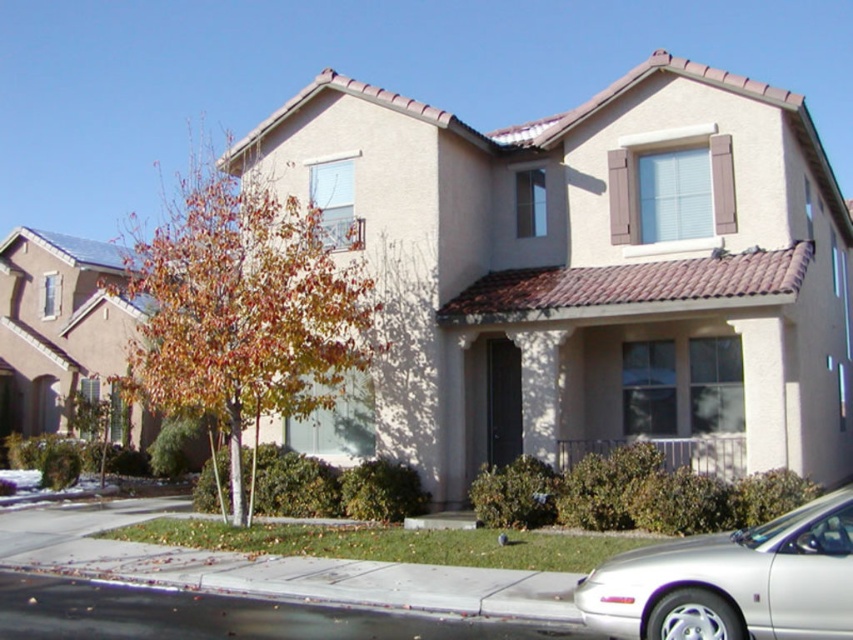
You are a delivery person driving a van that is 5.5 meters long. You need to park your van between the silver metallic sedan at lower right and the black asphalt curb at lower left. Is there enough space for your van to fit between them?

The distance between the silver metallic sedan at lower right and the black asphalt curb at lower left is 4.08 meters. Since your van is 5.5 meters long, there is not enough space to park between them.

You are a gardener trying to clear the driveway. You see autumn leaves at left and black asphalt curb at lower left. Which object is wider?

The autumn leaves at left might be wider than the black asphalt curb at lower left according to the description.